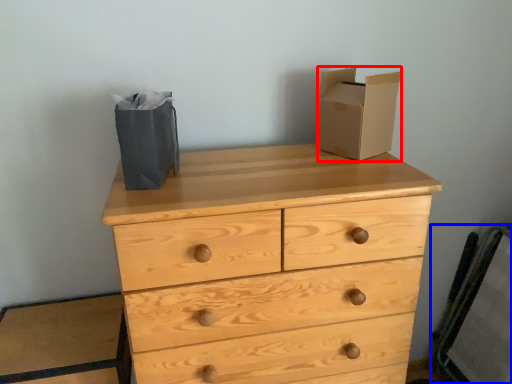
Question: Which object is closer to the camera taking this photo, cardboard box (highlighted by a red box) or chair (highlighted by a blue box)?

Choices:
 (A) cardboard box
 (B) chair

Answer: (A)